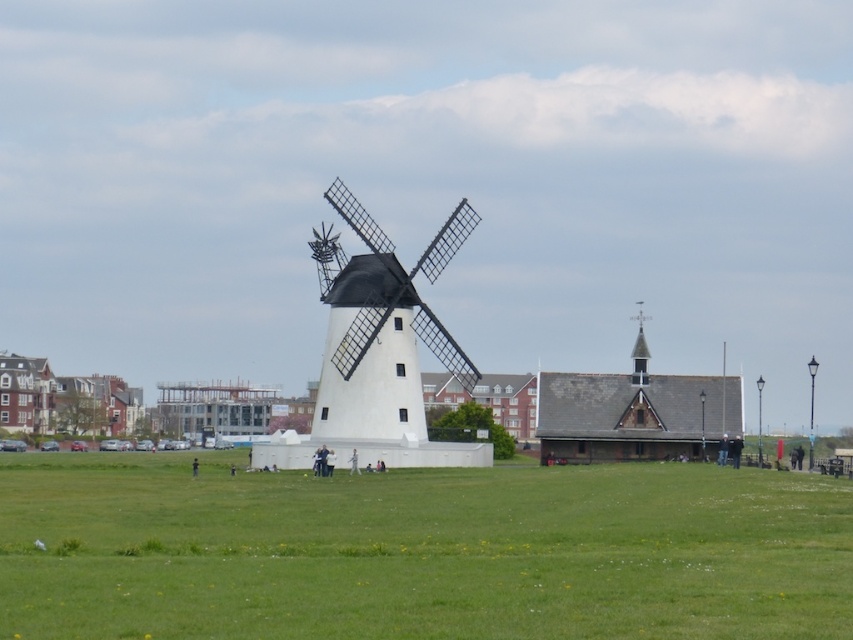
Question: Can you confirm if green grass at center is thinner than white matte windmill at center?

Choices:
 (A) no
 (B) yes

Answer: (A)

Question: Which object appears closest to the camera in this image?

Choices:
 (A) green grass at center
 (B) white matte windmill at center

Answer: (A)

Question: Is green grass at center wider than white matte windmill at center?

Choices:
 (A) yes
 (B) no

Answer: (A)

Question: Is green grass at center positioned before white matte windmill at center?

Choices:
 (A) no
 (B) yes

Answer: (B)

Question: Among these points, which one is farthest from the camera?

Choices:
 (A) (224, 508)
 (B) (341, 332)

Answer: (B)